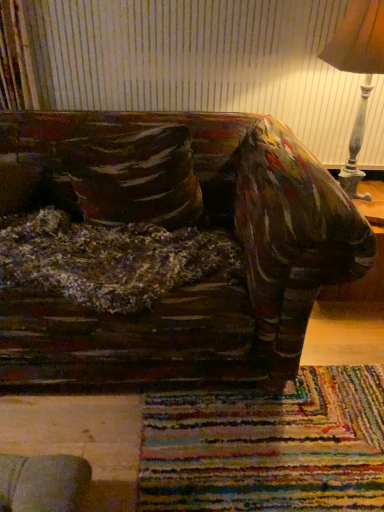
This screenshot has width=384, height=512. Describe the element at coordinates (358, 72) in the screenshot. I see `wooden lampshade at upper right` at that location.

Where is `wooden lampshade at upper right`? wooden lampshade at upper right is located at coordinates (358, 72).

Measure the distance between wooden lampshade at upper right and camera.

wooden lampshade at upper right is 1.51 meters from camera.

Identify the location of velvety brown pillow at left. This screenshot has height=512, width=384. (133, 173).

What do you see at coordinates (133, 173) in the screenshot? I see `velvety brown pillow at left` at bounding box center [133, 173].

Where is `wooden lampshade at upper right`? The image size is (384, 512). wooden lampshade at upper right is located at coordinates (358, 72).

Considering the relative positions of wooden lampshade at upper right and velvety brown pillow at left in the image provided, is wooden lampshade at upper right to the left of velvety brown pillow at left from the viewer's perspective?

Incorrect, wooden lampshade at upper right is not on the left side of velvety brown pillow at left.

Is wooden lampshade at upper right positioned behind velvety brown pillow at left?

No.

Considering the points (331, 44) and (111, 220), which point is in front, point (331, 44) or point (111, 220)?

The point (331, 44) is closer.

From the image's perspective, is wooden lampshade at upper right over velvety brown pillow at left?

Correct, wooden lampshade at upper right appears higher than velvety brown pillow at left in the image.

Looking at this image, from a real-world perspective, is wooden lampshade at upper right on top of velvety brown pillow at left?

Correct, in the physical world, wooden lampshade at upper right is higher than velvety brown pillow at left.

Considering the sizes of objects wooden lampshade at upper right and velvety brown pillow at left in the image provided, who is wider, wooden lampshade at upper right or velvety brown pillow at left?

Wider between the two is wooden lampshade at upper right.

Based on the photo, considering the sizes of objects wooden lampshade at upper right and velvety brown pillow at left in the image provided, who is shorter, wooden lampshade at upper right or velvety brown pillow at left?

velvety brown pillow at left.

In terms of size, does wooden lampshade at upper right appear bigger or smaller than velvety brown pillow at left?

In the image, wooden lampshade at upper right appears to be larger than velvety brown pillow at left.

Can velvety brown pillow at left be found inside wooden lampshade at upper right?

No, velvety brown pillow at left is not inside wooden lampshade at upper right.

Is wooden lampshade at upper right not near velvety brown pillow at left?

No, wooden lampshade at upper right is not far from velvety brown pillow at left.

Does wooden lampshade at upper right turn towards velvety brown pillow at left?

No, wooden lampshade at upper right does not turn towards velvety brown pillow at left.

The width and height of the screenshot is (384, 512). There is a velvety brown pillow at left. What are the coordinates of `lamp above it (from a real-world perspective)` in the screenshot? It's located at (358, 72).

Can you confirm if velvety brown pillow at left is positioned to the left of wooden lampshade at upper right?

Yes.

Which object is further away from the camera, velvety brown pillow at left or wooden lampshade at upper right?

velvety brown pillow at left is further away from the camera.

Considering the positions of points (135, 157) and (360, 140), is point (135, 157) closer to camera compared to point (360, 140)?

Yes, point (135, 157) is closer to viewer.

From the image's perspective, is velvety brown pillow at left above wooden lampshade at upper right?

No, from the image's perspective, velvety brown pillow at left is not over wooden lampshade at upper right.

From a real-world perspective, who is located higher, velvety brown pillow at left or wooden lampshade at upper right?

wooden lampshade at upper right, from a real-world perspective.

Consider the image. Can you confirm if velvety brown pillow at left is thinner than wooden lampshade at upper right?

Indeed, velvety brown pillow at left has a lesser width compared to wooden lampshade at upper right.

Considering the sizes of velvety brown pillow at left and wooden lampshade at upper right in the image, is velvety brown pillow at left taller or shorter than wooden lampshade at upper right?

Clearly, velvety brown pillow at left is shorter compared to wooden lampshade at upper right.

Is velvety brown pillow at left smaller than wooden lampshade at upper right?

Correct, velvety brown pillow at left occupies less space than wooden lampshade at upper right.

Is velvety brown pillow at left inside the boundaries of wooden lampshade at upper right, or outside?

velvety brown pillow at left is outside wooden lampshade at upper right.

Is velvety brown pillow at left beside wooden lampshade at upper right?

velvety brown pillow at left and wooden lampshade at upper right are not in contact.

Is velvety brown pillow at left aimed at wooden lampshade at upper right?

No, velvety brown pillow at left is not facing towards wooden lampshade at upper right.

How far apart are velvety brown pillow at left and wooden lampshade at upper right?

velvety brown pillow at left and wooden lampshade at upper right are 34.31 inches apart.

In the image, there is a wooden lampshade at upper right. Identify the location of throw pillow below it (from the image's perspective). The height and width of the screenshot is (512, 384). (133, 173).

This screenshot has height=512, width=384. Find the location of `throw pillow that appears on the left of wooden lampshade at upper right`. throw pillow that appears on the left of wooden lampshade at upper right is located at coordinates pyautogui.click(x=133, y=173).

Locate an element on the screen. lamp above the velvety brown pillow at left (from a real-world perspective) is located at coordinates (358, 72).